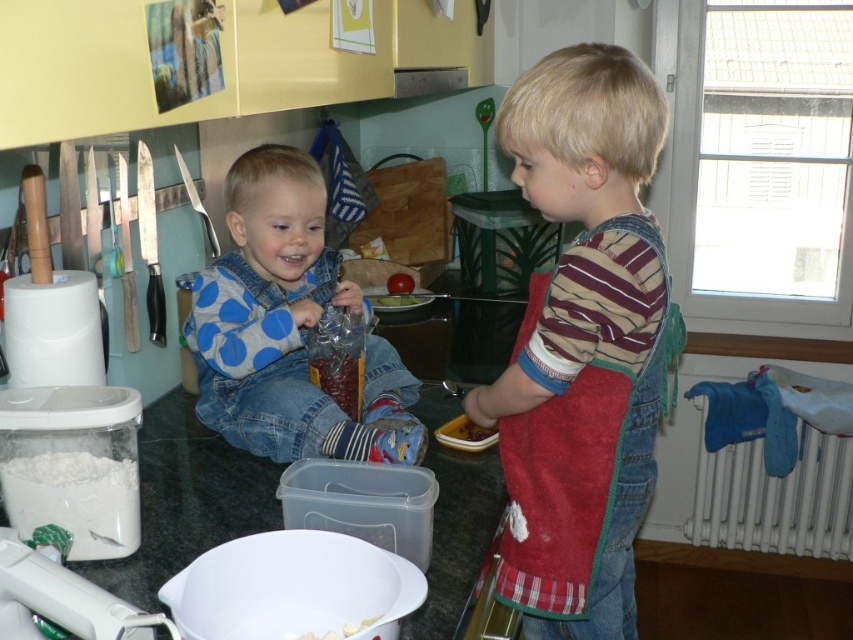
Is point (234, 435) less distant than point (44, 486)?

No, (234, 435) is further to viewer.

Is blue dotted shirt at center thinner than white powder at lower left?

Incorrect, blue dotted shirt at center's width is not less than white powder at lower left's.

Does point (212, 344) come in front of point (115, 496)?

That is False.

Locate an element on the screen. This screenshot has height=640, width=853. blue dotted shirt at center is located at coordinates (288, 326).

Is white creamy cheese at lower center smaller than shiny plastic container at center?

Incorrect, white creamy cheese at lower center is not smaller in size than shiny plastic container at center.

Is white creamy cheese at lower center above shiny plastic container at center?

No.

Locate an element on the screen. The image size is (853, 640). white creamy cheese at lower center is located at coordinates (341, 630).

Based on the photo, between blue dotted shirt at center and shiny plastic container at center, which one has less height?

shiny plastic container at center is shorter.

Can you confirm if blue dotted shirt at center is taller than shiny plastic container at center?

Yes.

At what (x,y) coordinates should I click in order to perform the action: click on blue dotted shirt at center. Please return your answer as a coordinate pair (x, y). Image resolution: width=853 pixels, height=640 pixels. Looking at the image, I should click on (288, 326).